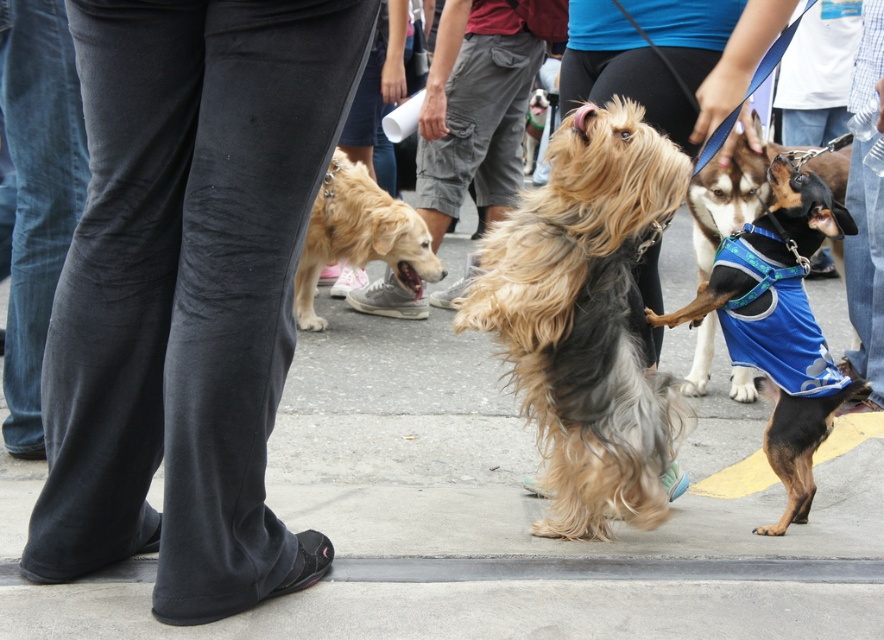
Is dark gray pants at left taller than fuzzy fur dog at center?

Yes, dark gray pants at left is taller than fuzzy fur dog at center.

This screenshot has width=884, height=640. I want to click on dark gray pants at left, so click(187, 291).

Does point (645, 188) lie behind point (79, 124)?

No, (645, 188) is in front of (79, 124).

Between shaggy brown fur at center and denim pants at lower left, which one appears on the right side from the viewer's perspective?

shaggy brown fur at center

Who is more forward, (593,259) or (16,296)?

Point (593,259) is in front.

Where is `shaggy brown fur at center`? shaggy brown fur at center is located at coordinates (587, 320).

Who is more distant from viewer, (837,209) or (326,205)?

Point (326,205)

Can you confirm if black and tan fabric dog at center right is positioned below golden fur dog at center?

Indeed, black and tan fabric dog at center right is positioned under golden fur dog at center.

Who is more forward, (824,195) or (395,253)?

Positioned in front is point (824,195).

The height and width of the screenshot is (640, 884). Find the location of `black and tan fabric dog at center right`. black and tan fabric dog at center right is located at coordinates (794, 218).